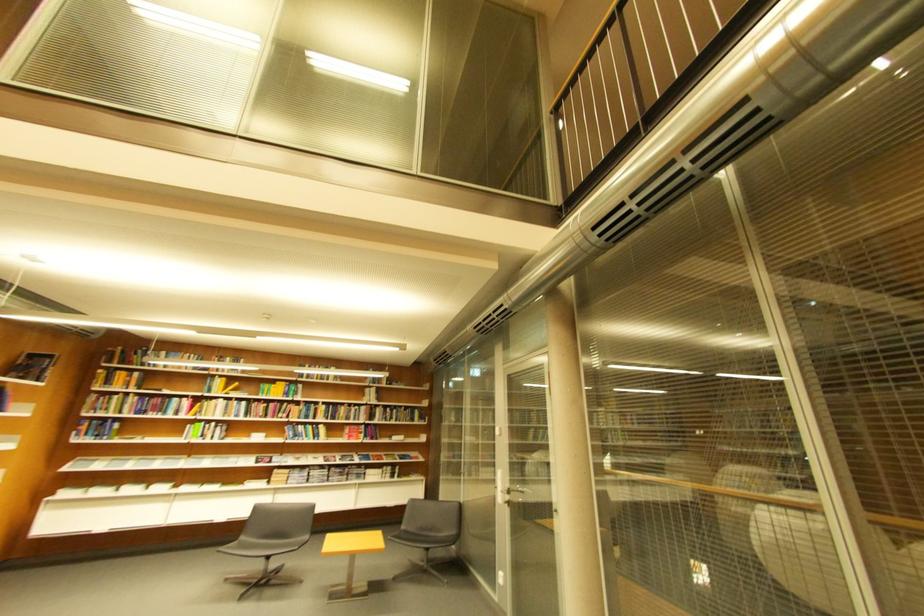
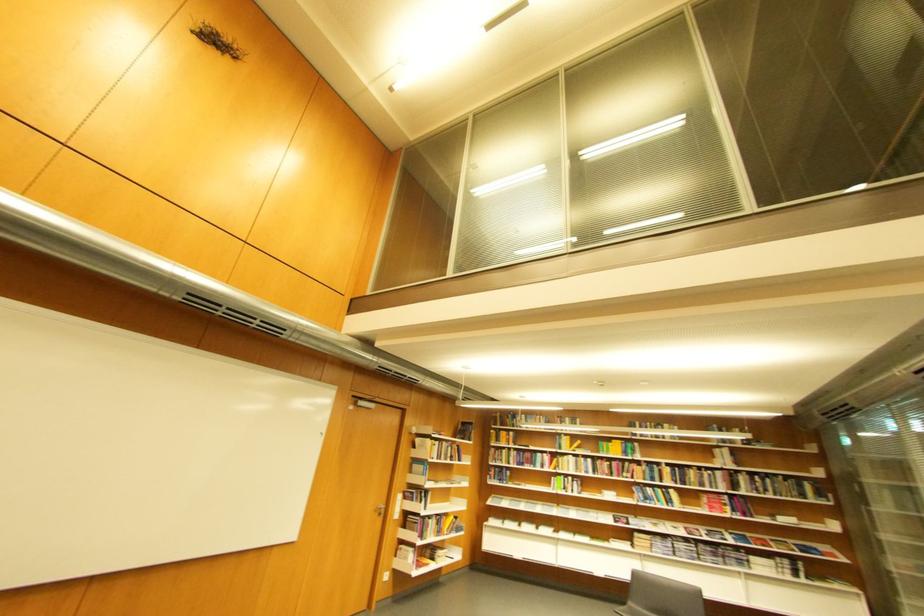
Find the pixel in the second image that matches pixel 313 477 in the first image.

(677, 549)